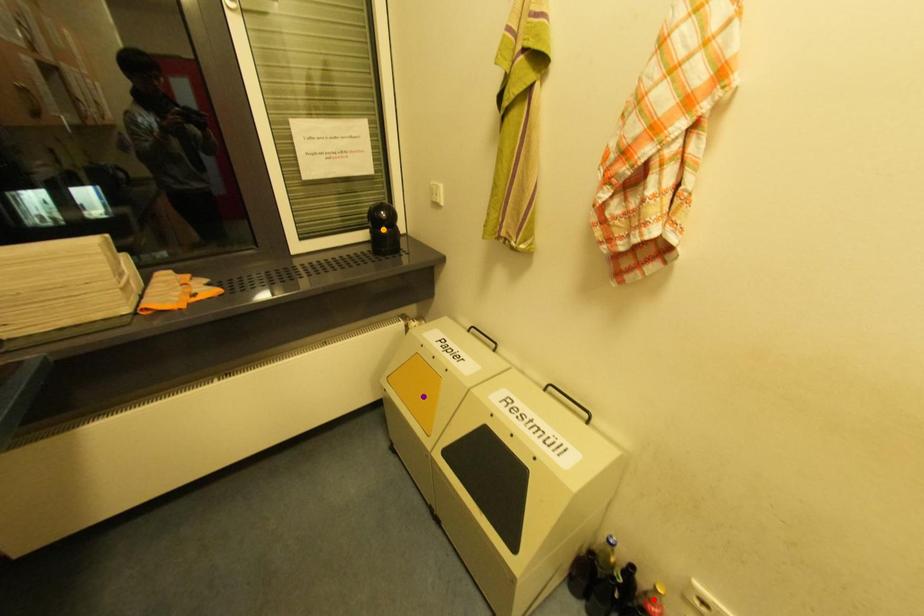
Order these from nearest to farthest:
purple point | orange point | red point

red point → purple point → orange point